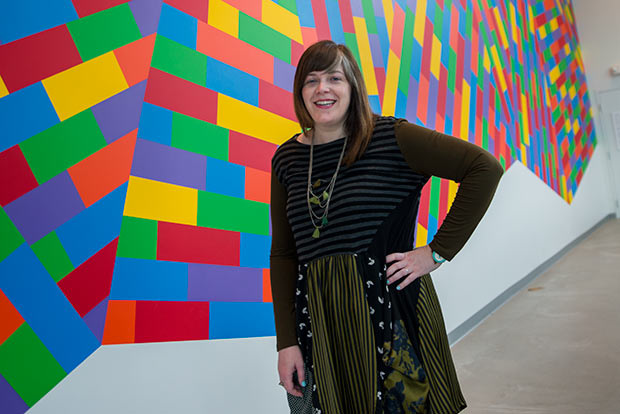
You are a GUI agent. You are given a task and a screenshot of the screen. Output one action in this format:
    pyautogui.click(x=<x>, y=<y>)
    Task: Click on the wall
    
    Given the screenshot: What is the action you would take?
    pyautogui.click(x=139, y=374)